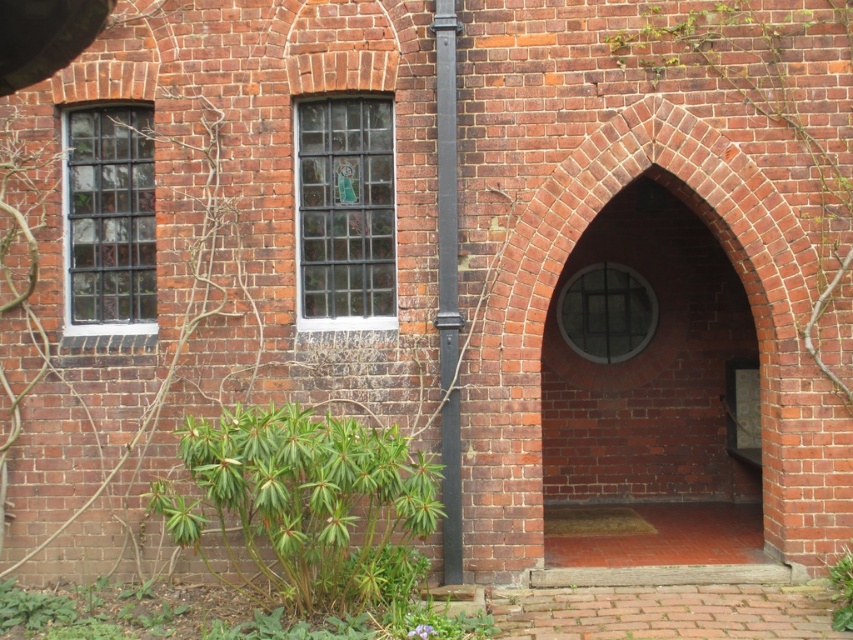
Question: Which of the following is the closest to the observer?

Choices:
 (A) (778, 38)
 (B) (440, 204)
 (C) (241, 481)

Answer: (C)

Question: Which object is positioned farthest from the green leafy plant at center?

Choices:
 (A) smooth brick archway at center
 (B) green leafy plant at lower left
 (C) green leafy plant at lower right
 (D) green leafy bush at lower left

Answer: (B)

Question: Is green leafy bush at lower left above green leafy plant at lower right?

Choices:
 (A) yes
 (B) no

Answer: (A)

Question: Which point is farther to the camera?

Choices:
 (A) (561, 426)
 (B) (844, 561)

Answer: (A)

Question: Where is smooth brick archway at center located in relation to green leafy plant at center in the image?

Choices:
 (A) below
 (B) above

Answer: (A)

Question: Is green leafy bush at lower left smaller than smooth black pole at center?

Choices:
 (A) no
 (B) yes

Answer: (A)